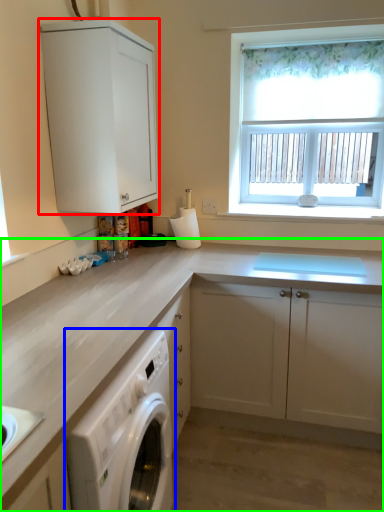
Question: Which object is positioned farthest from cabinetry (highlighted by a red box)? Select from home appliance (highlighted by a blue box) and cabinetry (highlighted by a green box).

Choices:
 (A) home appliance
 (B) cabinetry

Answer: (A)